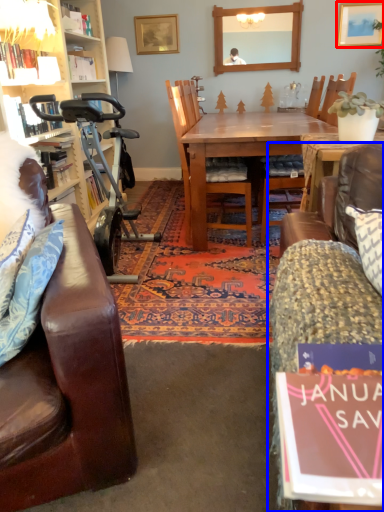
Question: Which object appears closest to the camera in this image, picture frame (highlighted by a red box) or studio couch (highlighted by a blue box)?

Choices:
 (A) picture frame
 (B) studio couch

Answer: (B)